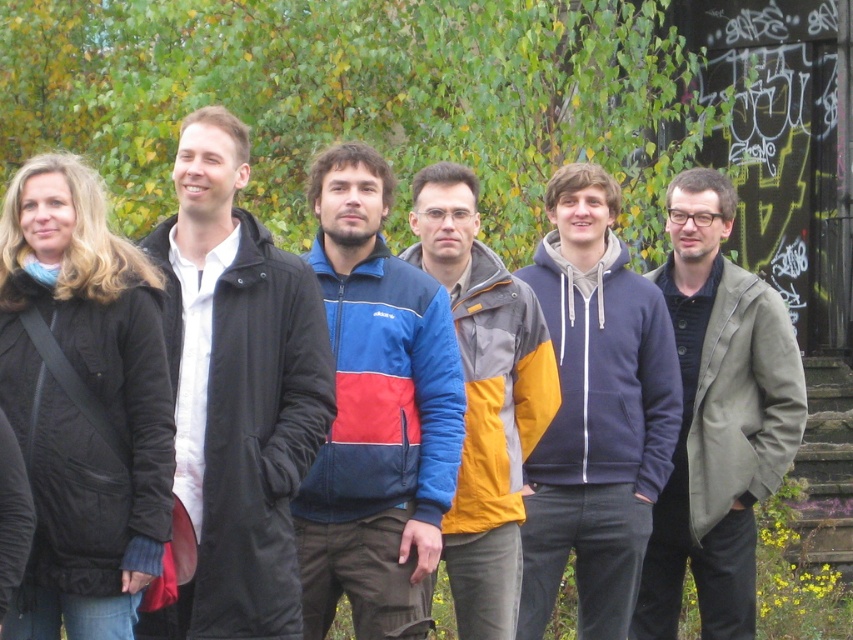
Question: Is navy blue hoodie at center to the left of multicolored jacket at center from the viewer's perspective?

Choices:
 (A) yes
 (B) no

Answer: (B)

Question: Which of the following is the closest to the observer?

Choices:
 (A) blue and red nylon jacket at center
 (B) black matte jacket at left
 (C) navy blue hoodie at center

Answer: (B)

Question: Is blue and red nylon jacket at center wider than matte gray coat at right?

Choices:
 (A) yes
 (B) no

Answer: (B)

Question: Which point is farther from the camera taking this photo?

Choices:
 (A) (581, 324)
 (B) (270, 490)
 (C) (111, 582)

Answer: (A)

Question: Which point is closer to the camera?

Choices:
 (A) matte black coat at left
 (B) blue and red nylon jacket at center
 (C) navy blue hoodie at center
 (D) multicolored jacket at center

Answer: (A)

Question: Does matte black coat at left appear on the left side of matte gray coat at right?

Choices:
 (A) no
 (B) yes

Answer: (B)